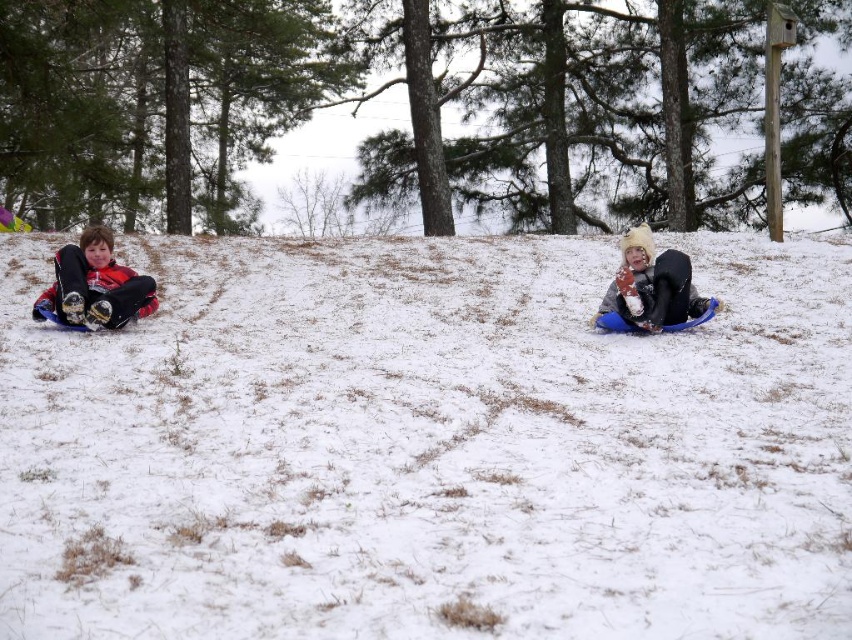
You are a photographer trying to capture both the matte black snowsuit at left and the fluffy white snowsuit at center in your shot. Given their sizes, which one might require you to step back more to include fully in the frame?

The fluffy white snowsuit at center requires stepping back more because it has a greater width than the matte black snowsuit at left.

Consider the image. You are a photographer trying to capture both the matte black snowsuit at left and the fluffy white snowsuit at center in a single shot. Which snowsuit will appear larger in the photo?

The matte black snowsuit at left appears larger in the photo because it is closer to the viewer than the fluffy white snowsuit at center.

You are standing at the bottom of the snowy hill and want to find the white fluffy snow at center. According to the coordinates provided, in which direction should you look to locate it?

The white fluffy snow at center is located at coordinates point (427,445), which means it is positioned slightly to the right and above your current viewpoint. To locate it, you should look towards the upper right direction from your current position.